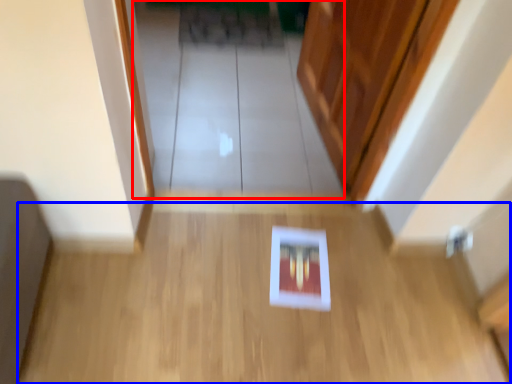
Question: Which of the following is the farthest to the observer, glass door (highlighted by a red box) or corridor (highlighted by a blue box)?

Choices:
 (A) glass door
 (B) corridor

Answer: (A)